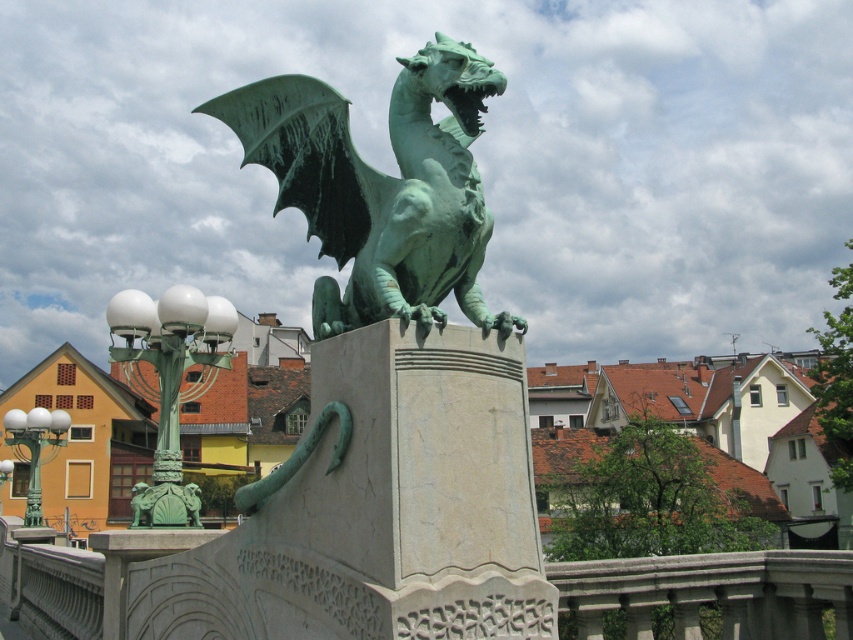
Where is the green patina dragon at center located in the image?

The green patina dragon at center is located at point (381,188) in the image.

You are a visitor at a park and see the green patina dragon at center and the green glass lamp post at left. Which object is shorter?

The green patina dragon at center is shorter than the green glass lamp post at left.

You are standing in front of the dragon statue and want to place a small offering at the exact location of point (167, 356). If your arm can reach up to 1.2 meters, can you reach that point without moving closer?

The point (167, 356) is 13.33 meters away from the camera, which is much farther than your arm can reach. You cannot reach it without moving closer.